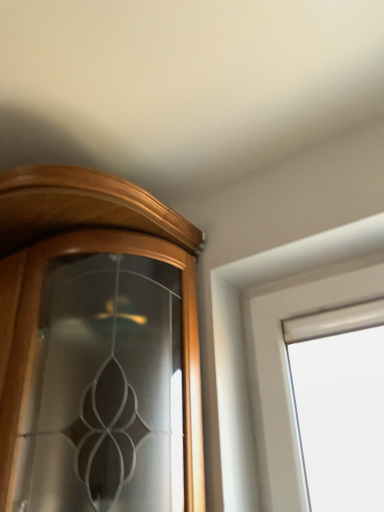
At what (x,y) coordinates should I click in order to perform the action: click on glossy wood cupboard at left. Please return your answer as a coordinate pair (x, y). This screenshot has height=512, width=384. Looking at the image, I should click on (97, 347).

What do you see at coordinates (97, 347) in the screenshot? This screenshot has width=384, height=512. I see `glossy wood cupboard at left` at bounding box center [97, 347].

Find the location of `glossy wood cupboard at left`. glossy wood cupboard at left is located at coordinates (97, 347).